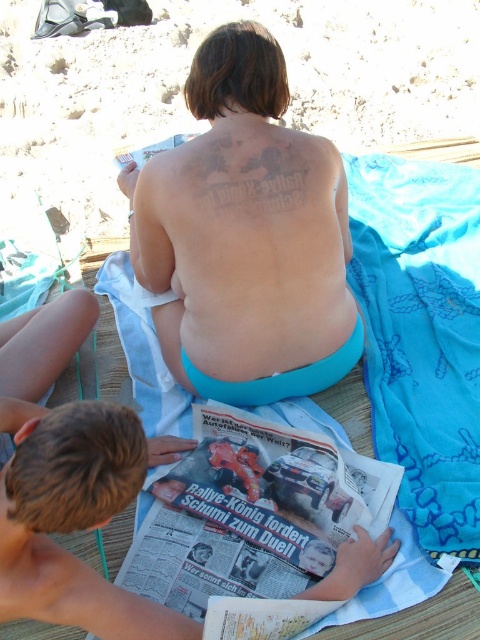
Who is positioned more to the left, blue fabric towel at center or blue fabric towel at lower right?

blue fabric towel at center

Image resolution: width=480 pixels, height=640 pixels. Describe the element at coordinates (419, 360) in the screenshot. I see `blue fabric towel at center` at that location.

Is point (415, 355) closer to viewer compared to point (424, 412)?

No.

Identify the location of blue fabric towel at center. Image resolution: width=480 pixels, height=640 pixels. (419, 360).

Does skinny blue shorts at center have a greater width compared to blue fabric towel at upper center?

In fact, skinny blue shorts at center might be narrower than blue fabric towel at upper center.

Is point (152, 218) positioned after point (32, 4)?

No, it is not.

Where is `skinny blue shorts at center`? skinny blue shorts at center is located at coordinates (245, 236).

Can you confirm if blue fabric towel at upper center is smaller than blue fabric towel at center?

No, blue fabric towel at upper center is not smaller than blue fabric towel at center.

The height and width of the screenshot is (640, 480). What do you see at coordinates (188, 68) in the screenshot?
I see `blue fabric towel at upper center` at bounding box center [188, 68].

Measure the distance between blue fabric towel at upper center and camera.

The distance of blue fabric towel at upper center from camera is 2.87 meters.

Locate an element on the screen. blue fabric towel at upper center is located at coordinates (188, 68).